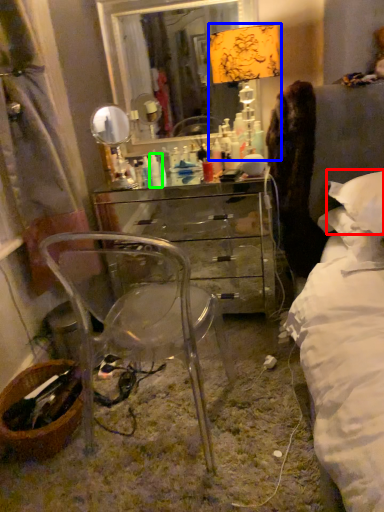
Question: Estimate the real-world distances between objects in this image. Which object is farther from pillow (highlighted by a red box), table lamp (highlighted by a blue box) or toiletry (highlighted by a green box)?

Choices:
 (A) table lamp
 (B) toiletry

Answer: (B)